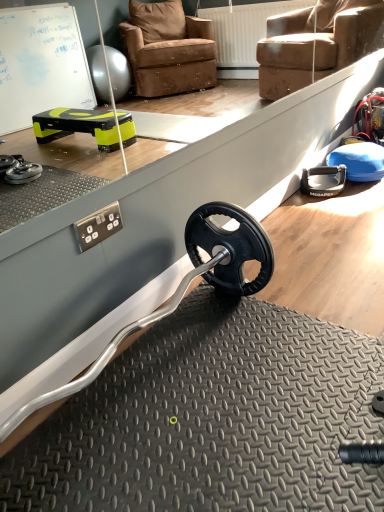
Where is `vacant region in front of black rubber push-up at right`? vacant region in front of black rubber push-up at right is located at coordinates (333, 204).